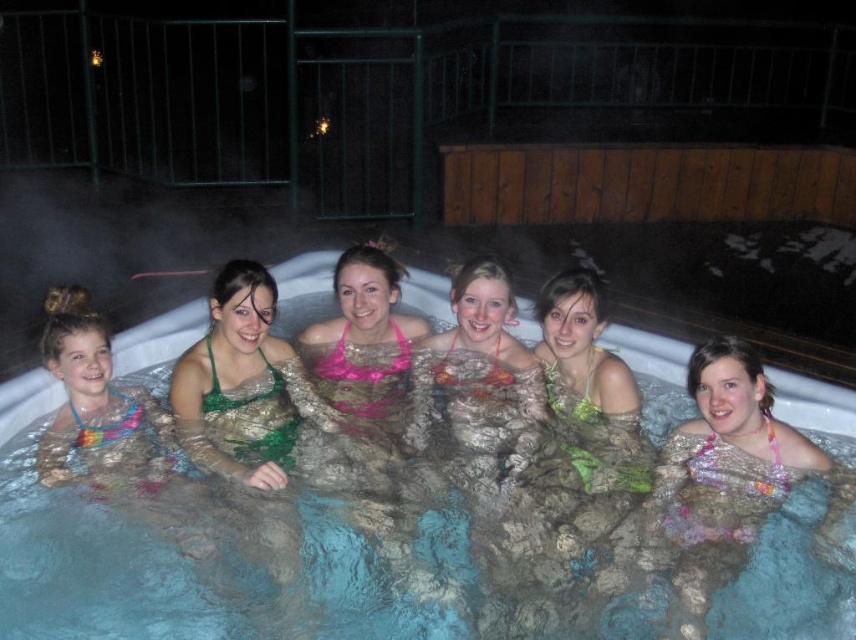
Measure the distance from clear plastic pool at center to multicolored fabric bikini at center.

clear plastic pool at center is 1.61 meters from multicolored fabric bikini at center.

Based on the photo, does clear plastic pool at center appear on the right side of multicolored fabric bikini at center?

In fact, clear plastic pool at center is to the left of multicolored fabric bikini at center.

The image size is (856, 640). In order to click on clear plastic pool at center in this screenshot , I will do `click(80, 552)`.

Does pink floral bikini at center have a greater width compared to pink fabric bikini at center?

Yes.

This screenshot has width=856, height=640. Describe the element at coordinates (724, 477) in the screenshot. I see `pink floral bikini at center` at that location.

In order to click on pink floral bikini at center in this screenshot , I will do `click(724, 477)`.

Looking at this image, does green fabric swimsuit at center appear on the left side of pink fabric bikini at center?

Indeed, green fabric swimsuit at center is positioned on the left side of pink fabric bikini at center.

Measure the distance between green fabric swimsuit at center and camera.

The distance of green fabric swimsuit at center from camera is 2.83 meters.

Where is `green fabric swimsuit at center`? Image resolution: width=856 pixels, height=640 pixels. green fabric swimsuit at center is located at coordinates point(248,417).